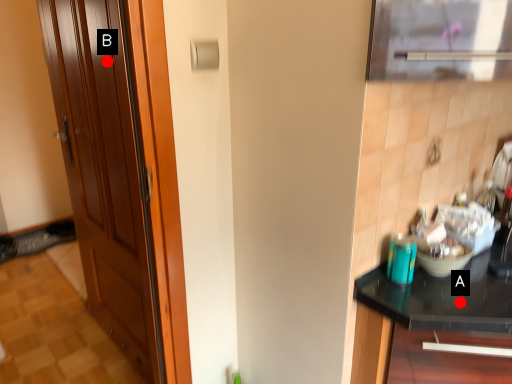
Question: Two points are circled on the image, labeled by A and B beside each circle. Which point appears closest to the camera in this image?

Choices:
 (A) A is closer
 (B) B is closer

Answer: (A)